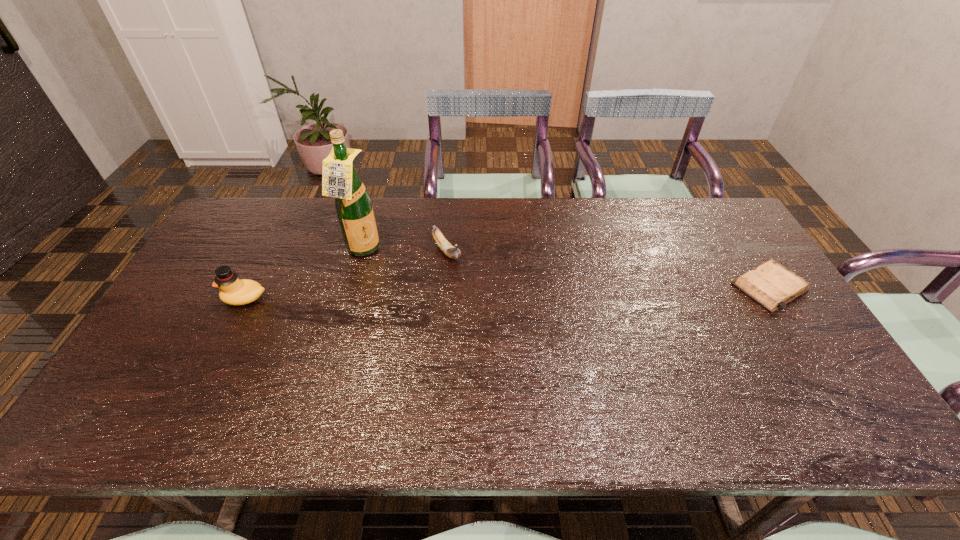
Where is `object situated at the left edge`? object situated at the left edge is located at coordinates (233, 291).

Image resolution: width=960 pixels, height=540 pixels. I want to click on object that is at the right edge, so click(771, 285).

This screenshot has width=960, height=540. I want to click on vacant area at the far edge, so click(640, 222).

Identify the location of vacant region at the near edge. (531, 388).

In the image, there is a desktop. Identify the location of blank space at the left edge. The image size is (960, 540). (176, 298).

You are a GUI agent. You are given a task and a screenshot of the screen. Output one action in this format:
    pyautogui.click(x=<x>, y=<y>)
    Task: Click on the free space at the far left corner of the desktop
    Image resolution: width=960 pixels, height=540 pixels.
    Given the screenshot: What is the action you would take?
    pyautogui.click(x=251, y=199)

In the image, there is a desktop. Find the location of `vacant space at the far right corner`. vacant space at the far right corner is located at coordinates click(727, 215).

Locate an element on the screen. vacant area between the shortest object and the duck is located at coordinates (507, 293).

Locate an element on the screen. The height and width of the screenshot is (540, 960). vacant region between the third tallest object and the leftmost object is located at coordinates (346, 275).

I want to click on empty space that is in between the leftmost object and the diary, so click(507, 293).